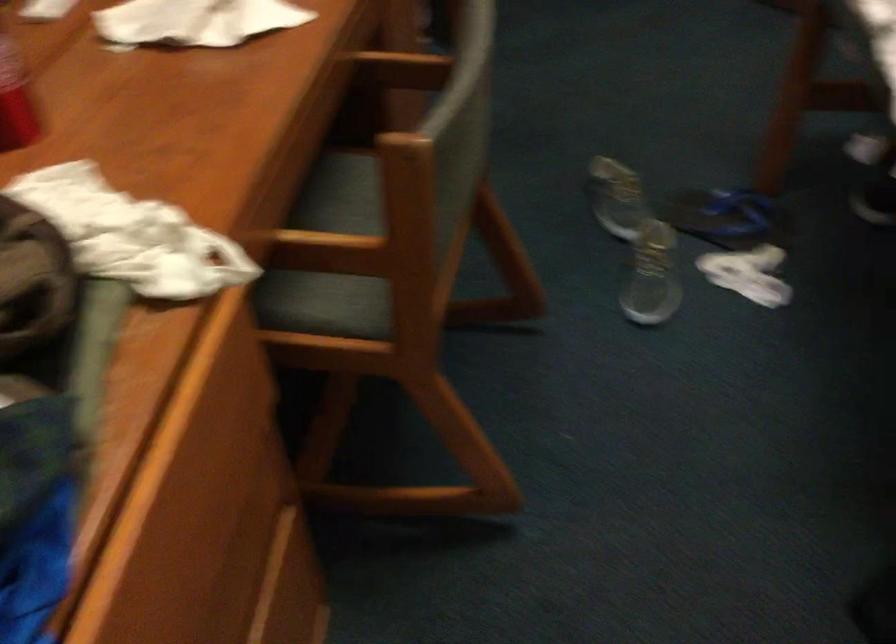
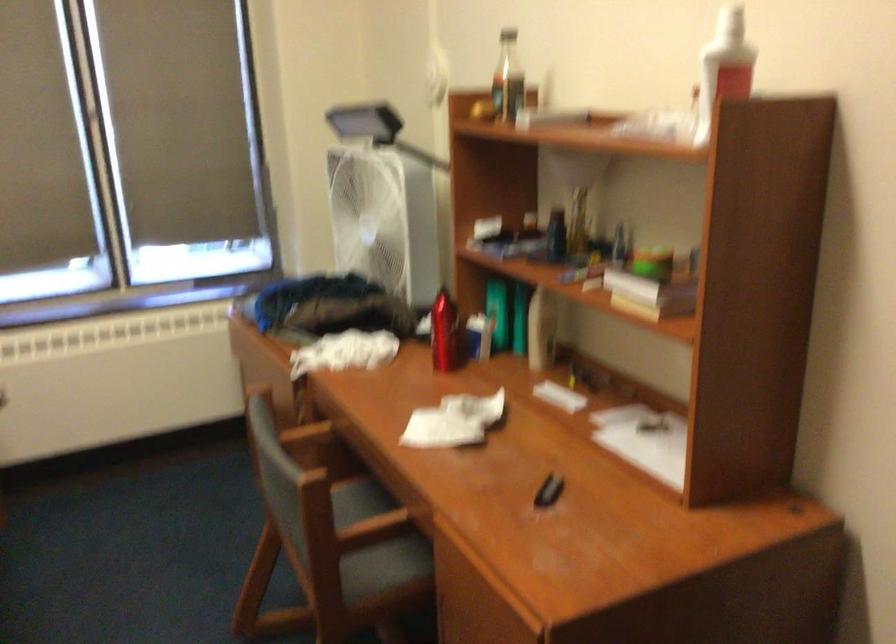
The point at (403,77) is marked in the first image. Where is the corresponding point in the second image?

(375, 545)